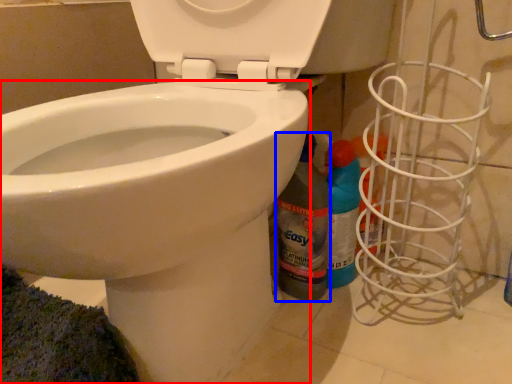
Question: Which object is further to the camera taking this photo, bidet (highlighted by a red box) or cleaning product (highlighted by a blue box)?

Choices:
 (A) bidet
 (B) cleaning product

Answer: (B)